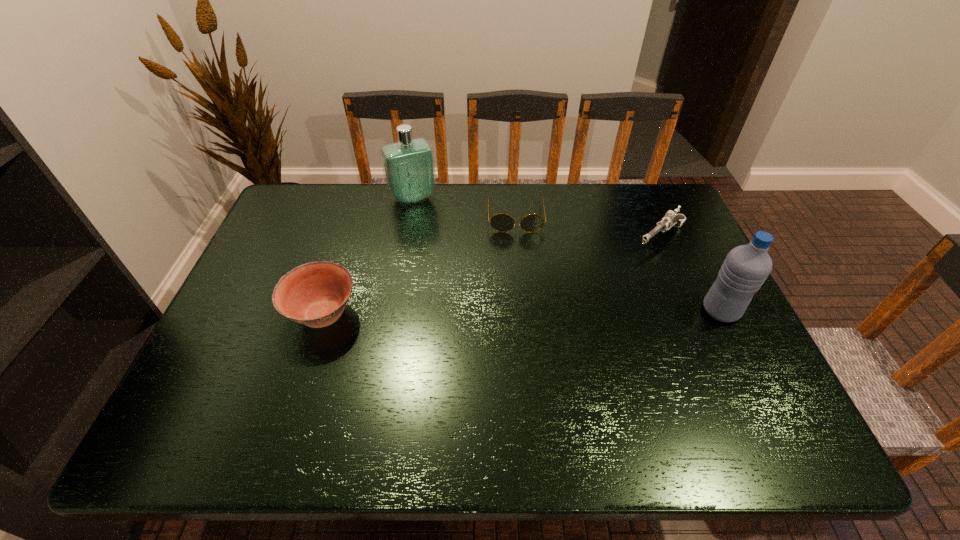
Where is `free space between the gun and the third object from left to right`? The width and height of the screenshot is (960, 540). free space between the gun and the third object from left to right is located at coordinates [588, 228].

Find the location of a particular element. The width and height of the screenshot is (960, 540). empty space between the third object from left to right and the gun is located at coordinates (588, 228).

Find the location of a particular element. The width and height of the screenshot is (960, 540). free space between the water bottle and the bowl is located at coordinates (522, 313).

What are the coordinates of `unoccupied area between the sunglasses and the gun` in the screenshot? It's located at (588, 228).

Find the location of a particular element. free area in between the bowl and the gun is located at coordinates (492, 276).

You are a GUI agent. You are given a task and a screenshot of the screen. Output one action in this format:
    pyautogui.click(x=<x>, y=<y>)
    Task: Click on the empty space between the water bottle and the sunglasses
    This screenshot has width=960, height=540.
    Given the screenshot: What is the action you would take?
    pyautogui.click(x=618, y=264)

Where is `free space between the gun and the water bottle`? free space between the gun and the water bottle is located at coordinates (690, 274).

The height and width of the screenshot is (540, 960). What are the coordinates of `free space between the shortest object and the perfume` in the screenshot? It's located at click(465, 208).

Where is `the closest object to the perfume`? the closest object to the perfume is located at coordinates (501, 222).

Point out which object is positioned as the fourth nearest to the gun. Please provide its 2D coordinates. Your answer should be formatted as a tuple, i.e. [(x, y)], where the tuple contains the x and y coordinates of a point satisfying the conditions above.

[(315, 294)]